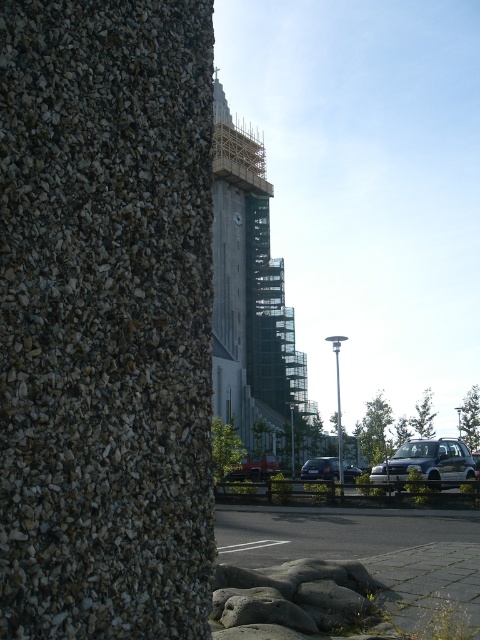
Is rough textured stone at center below silver metallic hatchback at lower right?

No.

Between rough textured stone at center and silver metallic hatchback at lower right, which one is positioned lower?

Positioned lower is silver metallic hatchback at lower right.

Where is `rough textured stone at center`? rough textured stone at center is located at coordinates (106, 317).

Is point (444, 621) less distant than point (269, 474)?

That is True.

Between point (384, 568) and point (230, 474), which one is positioned in front?

Point (384, 568) is more forward.

Locate an element on the screen. smooth concrete wall at center is located at coordinates (346, 593).

Image resolution: width=480 pixels, height=640 pixels. Identify the location of rough textured stone at center. (106, 317).

What are the coordinates of `rough textured stone at center` in the screenshot? It's located at (106, 317).